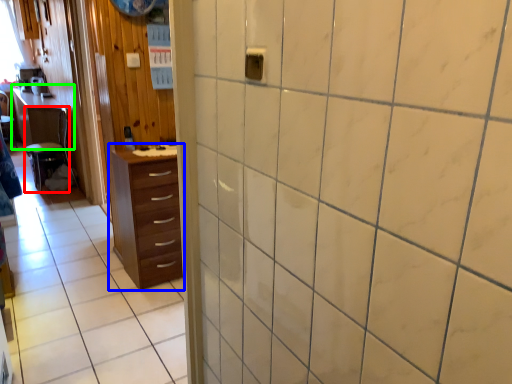
Question: Which is farther away from furniture (highlighted by a red box)? chest of drawers (highlighted by a blue box) or table (highlighted by a green box)?

Choices:
 (A) chest of drawers
 (B) table

Answer: (A)